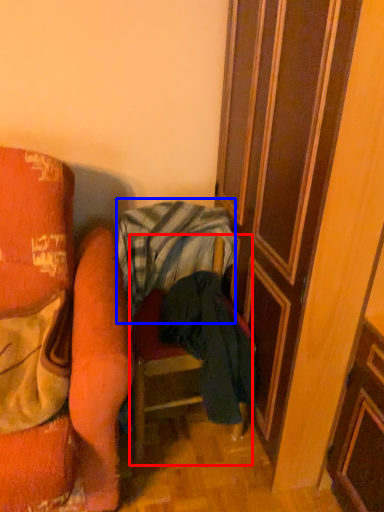
Question: Which point is closer to the camera, furniture (highlighted by a red box) or blanket (highlighted by a blue box)?

Choices:
 (A) furniture
 (B) blanket

Answer: (A)